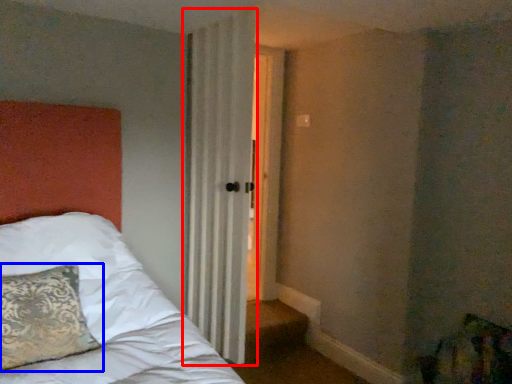
Question: Which object appears closest to the camera in this image, curtain (highlighted by a red box) or pillow (highlighted by a blue box)?

Choices:
 (A) curtain
 (B) pillow

Answer: (B)